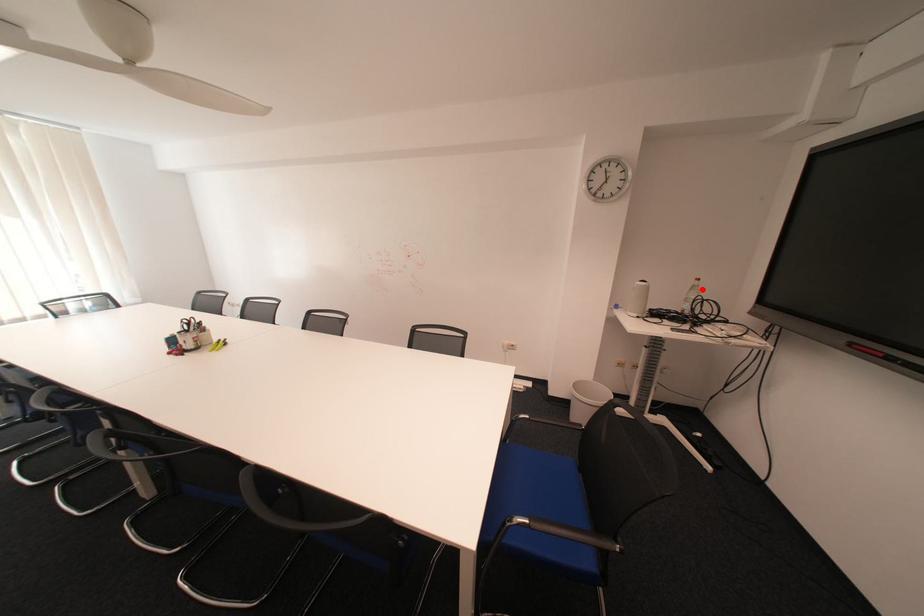
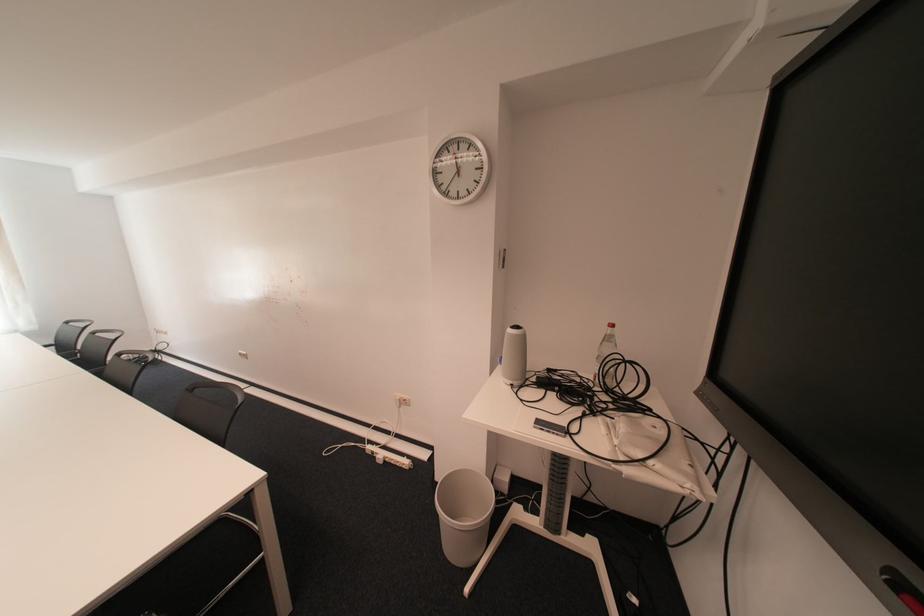
Where in the second image is the point corresponding to the highlighted location from the first image?

(614, 341)